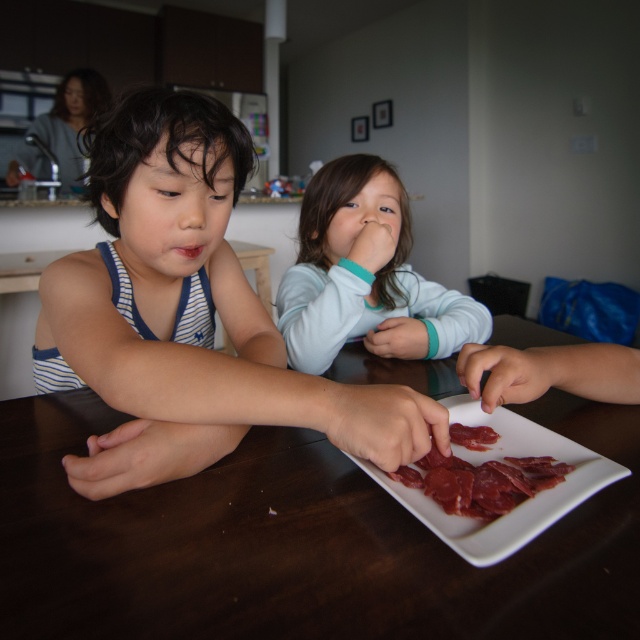
Question: Which of the following is the closest to the observer?

Choices:
 (A) smooth white shirt at center
 (B) white glossy platter at center

Answer: (B)

Question: Is blue striped tank top at left positioned in front of white glossy platter at center?

Choices:
 (A) no
 (B) yes

Answer: (A)

Question: Can you confirm if smooth white shirt at center is smaller than dried meat at center?

Choices:
 (A) no
 (B) yes

Answer: (A)

Question: Estimate the real-world distances between objects in this image. Which object is closer to the dried meat at center?

Choices:
 (A) white glossy platter at center
 (B) blue striped tank top at left

Answer: (A)

Question: Observing the image, what is the correct spatial positioning of brown wooden table at center in reference to smooth white shirt at center?

Choices:
 (A) right
 (B) left

Answer: (B)

Question: Which is farther from the brown wooden table at center?

Choices:
 (A) white glossy platter at center
 (B) smooth white shirt at center

Answer: (B)